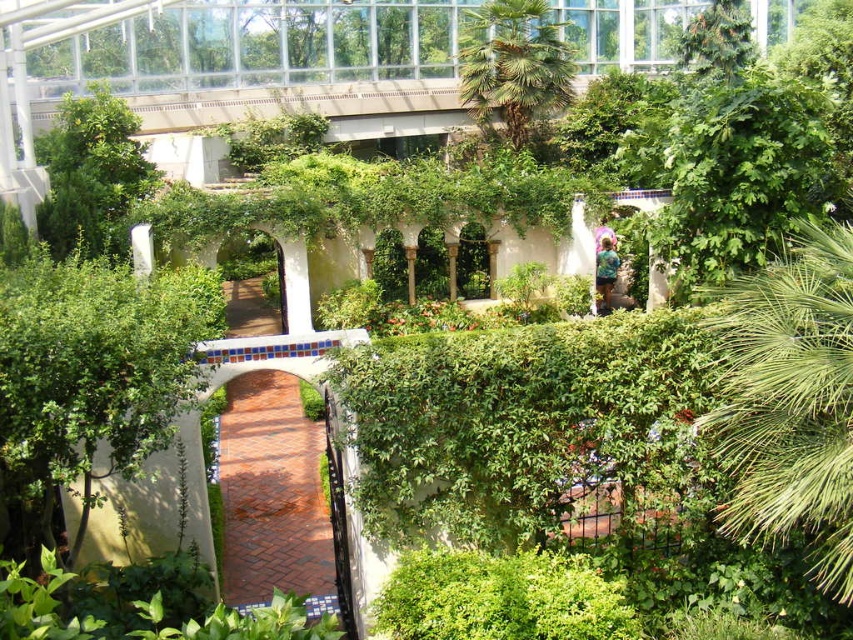
You are a gardener who needs to prune the green leafy palm at right and the green leafy palm tree at upper center. Which palm requires a shorter ladder to reach its widest point?

The green leafy palm at right has a lesser width compared to the green leafy palm tree at upper center, so the green leafy palm at right requires a shorter ladder to reach its widest point.

You are a gardener who needs to determine which plant is taller between the green leafy bush at lower left and the green leafy palm tree at upper center. Based on the scene, which one is taller?

The green leafy palm tree at upper center is taller than the green leafy bush at lower left.

You are standing at the entrance of the greenhouse and see the red brick pathway bordered by white tiles. If you walk straight ahead, will the green leafy bush at lower left come into your line of sight?

The green leafy bush at lower left is located at point (94, 372), which is to the lower left of the image. Since you are entering from the entrance and walking straight ahead, your path would likely be along the red brick pathway. The coordinates suggest the bush is positioned off to the side, so it might not come directly into your line of sight unless you turn towards the lower left area. However, without specific information about obstructions or the exact path direction, it is uncertain. The question